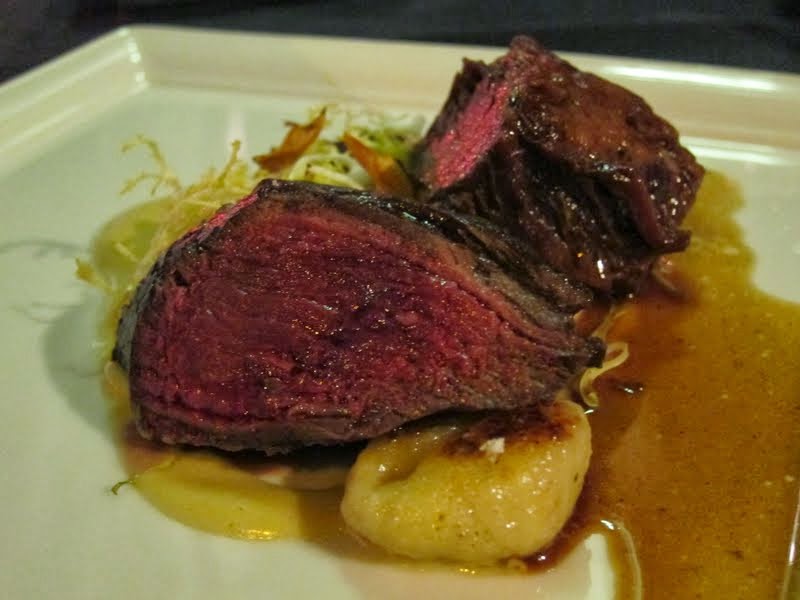
Where is `white plate`? The image size is (800, 600). white plate is located at coordinates (164, 566).